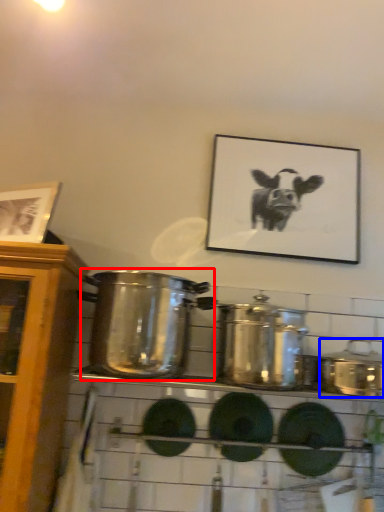
Question: Which object is further to the camera taking this photo, crock pot (highlighted by a red box) or crock pot (highlighted by a blue box)?

Choices:
 (A) crock pot
 (B) crock pot

Answer: (B)